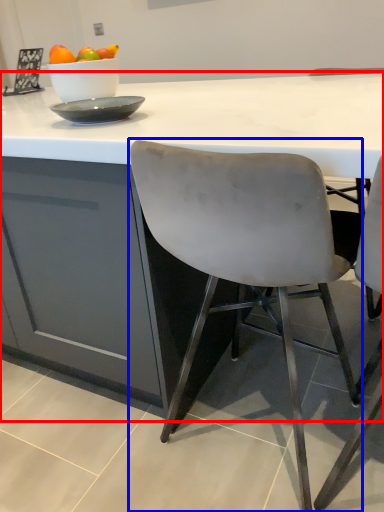
Question: Which object appears farthest to the camera in this image, table (highlighted by a red box) or chair (highlighted by a blue box)?

Choices:
 (A) table
 (B) chair

Answer: (A)